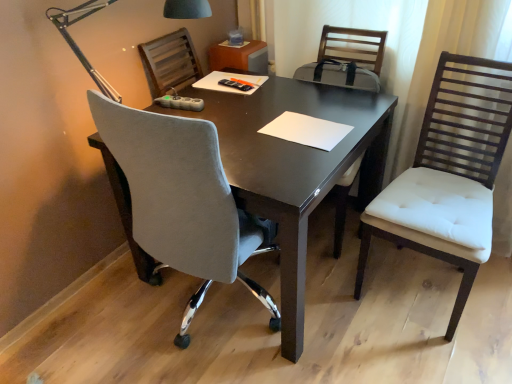
Find the location of a particular element. unoccupied area in front of white tufted cushion chair at right, acting as the 1th chair starting from the right is located at coordinates (439, 351).